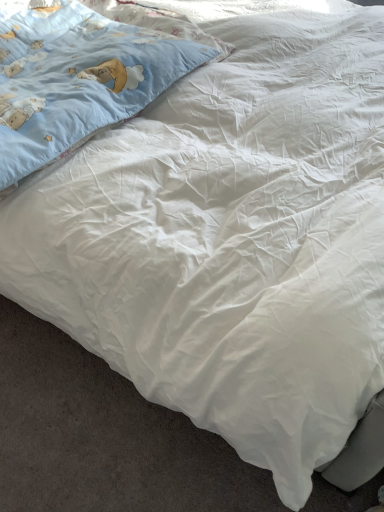
The image size is (384, 512). Describe the element at coordinates (77, 79) in the screenshot. I see `light blue cotton pillow at upper left` at that location.

Locate an element on the screen. Image resolution: width=384 pixels, height=512 pixels. light blue cotton pillow at upper left is located at coordinates (77, 79).

You are a GUI agent. You are given a task and a screenshot of the screen. Output one action in this format:
    pyautogui.click(x=<x>, y=<y>)
    Task: Click on the light blue cotton pillow at upper left
    The image size is (384, 512).
    Given the screenshot: What is the action you would take?
    pyautogui.click(x=77, y=79)